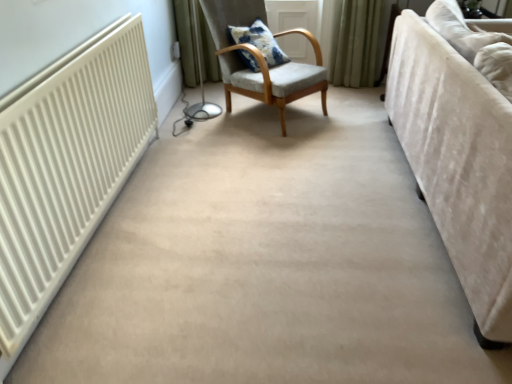
Question: From a real-world perspective, is velvet beige couch at right positioned above or below blue printed cushion at center?

Choices:
 (A) above
 (B) below

Answer: (B)

Question: From the image's perspective, is velvet beige couch at right positioned above or below blue printed cushion at center?

Choices:
 (A) above
 (B) below

Answer: (B)

Question: Which object is positioned farthest from the blue printed cushion at center?

Choices:
 (A) light gray fabric chair at center
 (B) velvet beige couch at right

Answer: (B)

Question: Which is nearer to the velvet beige couch at right?

Choices:
 (A) light gray fabric chair at center
 (B) blue printed cushion at center

Answer: (A)